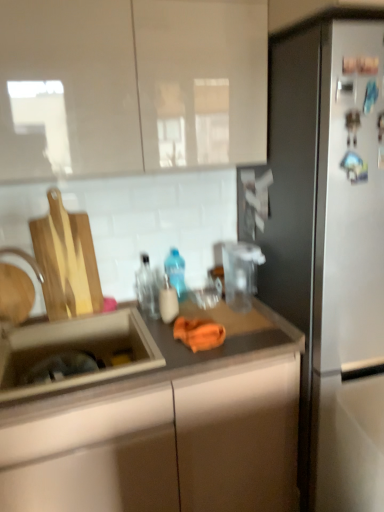
Consider the image. In order to face transparent glass bottle at center, the second bottle when ordered from back to front, should I rotate leftwards or rightwards?

Turn left approximately 5.565 degrees to face it.

You are a GUI agent. You are given a task and a screenshot of the screen. Output one action in this format:
    pyautogui.click(x=<x>, y=<y>)
    Task: Click on the glossy white cabinet at upper center
    This screenshot has height=512, width=384.
    Given the screenshot: What is the action you would take?
    pyautogui.click(x=131, y=86)

What do you see at coordinates (131, 86) in the screenshot? I see `glossy white cabinet at upper center` at bounding box center [131, 86].

At what (x,y) coordinates should I click in order to perform the action: click on blue translucent bottle at center, marked as the 1th bottle in a back-to-front arrangement. Please return your answer as a coordinate pair (x, y). Looking at the image, I should click on (176, 272).

Locate an element on the screen. stainless steel refrigerator at right is located at coordinates (330, 247).

Is the surface of matte brown countertop at center in direct contact with stainless steel refrigerator at right?

No, matte brown countertop at center is not next to stainless steel refrigerator at right.

Can you confirm if matte brown countertop at center is shorter than stainless steel refrigerator at right?

Correct, matte brown countertop at center is not as tall as stainless steel refrigerator at right.

Is matte brown countertop at center not within stainless steel refrigerator at right?

matte brown countertop at center is positioned outside stainless steel refrigerator at right.

Does matte brown countertop at center have a lesser width compared to stainless steel refrigerator at right?

Yes, matte brown countertop at center is thinner than stainless steel refrigerator at right.

Which of these two, brushed metal faucet at sink left or matte plastic soap dispenser at center, marked as the third bottle in a back-to-front arrangement, is smaller?

Smaller between the two is matte plastic soap dispenser at center, marked as the third bottle in a back-to-front arrangement.

Is point (5, 320) less distant than point (159, 297)?

Yes, point (5, 320) is closer to viewer.

Is brushed metal faucet at sink left completely or partially outside of matte plastic soap dispenser at center, marked as the third bottle in a back-to-front arrangement?

Yes, brushed metal faucet at sink left is outside of matte plastic soap dispenser at center, marked as the third bottle in a back-to-front arrangement.

Considering the relative sizes of brushed metal faucet at sink left and matte plastic soap dispenser at center, marked as the first bottle in a front-to-back arrangement, in the image provided, is brushed metal faucet at sink left taller than matte plastic soap dispenser at center, marked as the first bottle in a front-to-back arrangement,?

Yes.

Is glossy white cabinet at upper center far away from stainless steel refrigerator at right?

No, glossy white cabinet at upper center is not far away from stainless steel refrigerator at right.

Is glossy white cabinet at upper center further to the viewer compared to stainless steel refrigerator at right?

Yes, it is behind stainless steel refrigerator at right.

Who is shorter, glossy white cabinet at upper center or stainless steel refrigerator at right?

With less height is glossy white cabinet at upper center.

Visually, is glossy white cabinet at upper center positioned to the left or to the right of stainless steel refrigerator at right?

In the image, glossy white cabinet at upper center appears on the left side of stainless steel refrigerator at right.

From the image's perspective, which one is positioned lower, blue translucent bottle at center, which ranks as the 3th bottle in front-to-back order, or matte plastic soap dispenser at center, marked as the first bottle in a front-to-back arrangement?

From the image's view, matte plastic soap dispenser at center, marked as the first bottle in a front-to-back arrangement, is below.

Which is behind, point (177, 259) or point (159, 303)?

Positioned behind is point (177, 259).

Is blue translucent bottle at center, which ranks as the 3th bottle in front-to-back order, oriented towards matte plastic soap dispenser at center, marked as the first bottle in a front-to-back arrangement?

No, blue translucent bottle at center, which ranks as the 3th bottle in front-to-back order, is not turned towards matte plastic soap dispenser at center, marked as the first bottle in a front-to-back arrangement.

Considering the sizes of blue translucent bottle at center, marked as the 1th bottle in a back-to-front arrangement, and matte plastic soap dispenser at center, marked as the first bottle in a front-to-back arrangement, in the image, is blue translucent bottle at center, marked as the 1th bottle in a back-to-front arrangement, bigger or smaller than matte plastic soap dispenser at center, marked as the first bottle in a front-to-back arrangement,?

In the image, blue translucent bottle at center, marked as the 1th bottle in a back-to-front arrangement, appears to be larger than matte plastic soap dispenser at center, marked as the first bottle in a front-to-back arrangement.

How different are the orientations of blue translucent bottle at center, which ranks as the 3th bottle in front-to-back order, and matte brown countertop at center in degrees?

1.4 degrees separate the facing orientations of blue translucent bottle at center, which ranks as the 3th bottle in front-to-back order, and matte brown countertop at center.

You are a GUI agent. You are given a task and a screenshot of the screen. Output one action in this format:
    pyautogui.click(x=<x>, y=<y>)
    Task: Click on the countertop lying in front of the blue translucent bottle at center, which ranks as the 3th bottle in front-to-back order
    
    Given the screenshot: What is the action you would take?
    pyautogui.click(x=166, y=432)

Which is correct: blue translucent bottle at center, which ranks as the 3th bottle in front-to-back order, is inside matte brown countertop at center, or outside of it?

blue translucent bottle at center, which ranks as the 3th bottle in front-to-back order, is outside matte brown countertop at center.

From the image's perspective, is blue translucent bottle at center, marked as the 1th bottle in a back-to-front arrangement, over matte brown countertop at center?

Yes, from the image's perspective, blue translucent bottle at center, marked as the 1th bottle in a back-to-front arrangement, is over matte brown countertop at center.

From the picture: Is blue translucent bottle at center, which ranks as the 3th bottle in front-to-back order, not close to stainless steel refrigerator at right?

No.

Does point (177, 275) appear closer or farther from the camera than point (303, 259)?

Point (177, 275).

Is blue translucent bottle at center, which ranks as the 3th bottle in front-to-back order, oriented towards stainless steel refrigerator at right?

No, blue translucent bottle at center, which ranks as the 3th bottle in front-to-back order, is not turned towards stainless steel refrigerator at right.

Can you confirm if blue translucent bottle at center, marked as the 1th bottle in a back-to-front arrangement, is thinner than stainless steel refrigerator at right?

Yes.

Is stainless steel refrigerator at right facing away from brushed metal faucet at sink left?

stainless steel refrigerator at right is not turned away from brushed metal faucet at sink left.

Can we say stainless steel refrigerator at right lies outside brushed metal faucet at sink left?

Yes, stainless steel refrigerator at right is located beyond the bounds of brushed metal faucet at sink left.

Which object is further away from the camera, stainless steel refrigerator at right or brushed metal faucet at sink left?

Positioned behind is brushed metal faucet at sink left.

The image size is (384, 512). I want to click on countertop below the stainless steel refrigerator at right (from the image's perspective), so click(x=166, y=432).

In order to click on faucet in front of the matte plastic soap dispenser at center, marked as the first bottle in a front-to-back arrangement in this screenshot , I will do `click(15, 293)`.

Considering their positions, is glossy white cabinet at upper center positioned closer to brushed metal faucet at sink left than transparent glass bottle at center, the second bottle when ordered from back to front?

transparent glass bottle at center, the second bottle when ordered from back to front, is positioned closer to the anchor brushed metal faucet at sink left.

Which object lies nearer to the anchor point blue translucent bottle at center, marked as the 1th bottle in a back-to-front arrangement, stainless steel refrigerator at right or transparent glass bottle at center, the second bottle when ordered from back to front?

The object closer to blue translucent bottle at center, marked as the 1th bottle in a back-to-front arrangement, is transparent glass bottle at center, the second bottle when ordered from back to front.

When comparing their distances from matte plastic soap dispenser at center, marked as the first bottle in a front-to-back arrangement, does transparent glass bottle at center, which is the second bottle from front to back, or matte brown countertop at center seem further?

matte brown countertop at center lies further to matte plastic soap dispenser at center, marked as the first bottle in a front-to-back arrangement, than the other object.

From the image, which object appears to be nearer to blue translucent bottle at center, which ranks as the 3th bottle in front-to-back order, glossy white cabinet at upper center or stainless steel refrigerator at right?

stainless steel refrigerator at right.

Consider the image. When comparing their distances from matte brown countertop at center, does glossy white cabinet at upper center or stainless steel refrigerator at right seem closer?

stainless steel refrigerator at right is positioned closer to the anchor matte brown countertop at center.

Looking at this image, which object lies further to the anchor point matte plastic soap dispenser at center, marked as the third bottle in a back-to-front arrangement, glossy white cabinet at upper center or stainless steel refrigerator at right?

glossy white cabinet at upper center.

Looking at the image, which one is located further to transparent glass bottle at center, the second bottle when ordered from back to front, matte brown countertop at center or glossy white cabinet at upper center?

The object further to transparent glass bottle at center, the second bottle when ordered from back to front, is glossy white cabinet at upper center.

Looking at the image, which one is located further to transparent glass bottle at center, the second bottle when ordered from back to front, stainless steel refrigerator at right or matte plastic soap dispenser at center, marked as the first bottle in a front-to-back arrangement?

Based on the image, stainless steel refrigerator at right appears to be further to transparent glass bottle at center, the second bottle when ordered from back to front.

Locate an element on the screen. refrigerator between glossy white cabinet at upper center and matte brown countertop at center in the vertical direction is located at coordinates (330, 247).

Find the location of `faucet between transparent glass bottle at center, which is the second bottle from front to back, and matte brown countertop at center in the up-down direction`. faucet between transparent glass bottle at center, which is the second bottle from front to back, and matte brown countertop at center in the up-down direction is located at coordinates (15, 293).

Locate an element on the screen. The height and width of the screenshot is (512, 384). countertop situated between brushed metal faucet at sink left and stainless steel refrigerator at right from left to right is located at coordinates (166, 432).

Where is `countertop between brushed metal faucet at sink left and matte plastic soap dispenser at center, marked as the third bottle in a back-to-front arrangement, in the horizontal direction`? The image size is (384, 512). countertop between brushed metal faucet at sink left and matte plastic soap dispenser at center, marked as the third bottle in a back-to-front arrangement, in the horizontal direction is located at coordinates (166, 432).